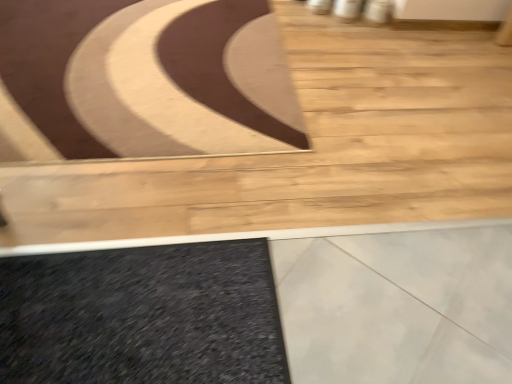
Question: Should I look upward or downward to see granite stairs at center?

Choices:
 (A) down
 (B) up

Answer: (B)